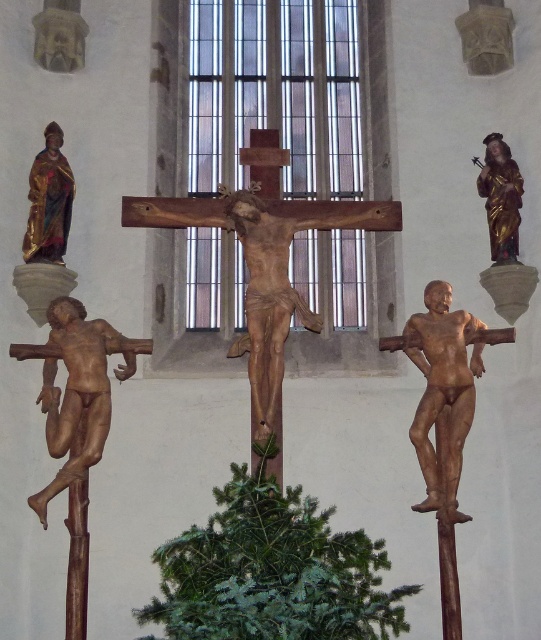
Question: Among these objects, which one is nearest to the camera?

Choices:
 (A) gold-painted wood statue at upper right
 (B) brown wooden crucifix at right
 (C) wooden crucifix at center
 (D) brown wood crucifix at left

Answer: (C)

Question: Is brown wood crucifix at left bigger than gold-painted wood statue at upper right?

Choices:
 (A) no
 (B) yes

Answer: (B)

Question: Which point is closer to the camera?

Choices:
 (A) brown wooden crucifix at right
 (B) brown wood crucifix at left
 (C) gold-painted wood statue at upper right
 (D) wooden crucifix at center

Answer: (D)

Question: Is wooden crucifix at center wider than gold-painted wood statue at upper right?

Choices:
 (A) no
 (B) yes

Answer: (B)

Question: Based on their relative distances, which object is nearer to the wooden crucifix at center?

Choices:
 (A) gold-painted wood statue at upper right
 (B) brown wooden crucifix at right
 (C) brown wood crucifix at left

Answer: (B)

Question: Does wooden crucifix at center have a greater width compared to gold-painted wood statue at upper right?

Choices:
 (A) no
 (B) yes

Answer: (B)